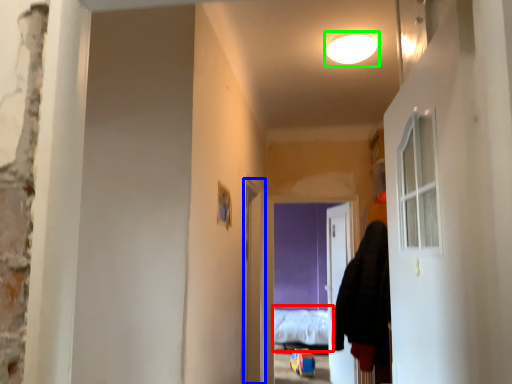
Question: Which object is the farthest from bed (highlighted by a red box)? Choose among these: screen door (highlighted by a blue box) or light (highlighted by a green box).

Choices:
 (A) screen door
 (B) light

Answer: (B)